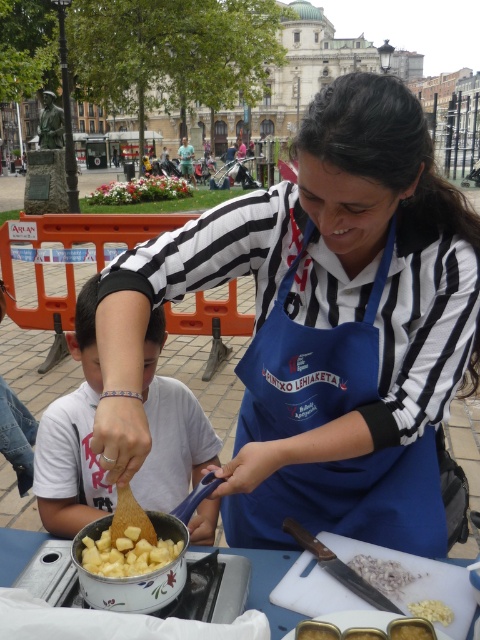
You are a food critic standing at the edge of the square, 10 meters away from the blue fabric apron at center. You want to walk directly to the white matte shirt at left without moving any objects. Can you reach it in a straight line?

The distance between the blue fabric apron at center and the white matte shirt at left is 9.26 meters. Since you are already 10 meters away from the apron, the total distance to the shirt would be approximately 19.26 meters. However, the question only asks if you can reach it in a straight line, which is possible as there are no mentioned obstacles in the scene description. Therefore, yes, you can reach the white matte shirt at left in a straight line.

You are a food critic attending a cooking event. You see the white matte shirt at left and the white crumbly food at lower center. Which object is positioned more to the left?

The white matte shirt at left is positioned more to the left than the white crumbly food at lower center.